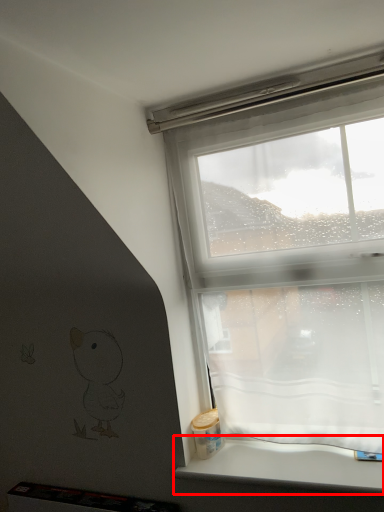
Question: Observing the image, what is the correct spatial positioning of window sill (annotated by the red box) in reference to window?

Choices:
 (A) right
 (B) left

Answer: (B)